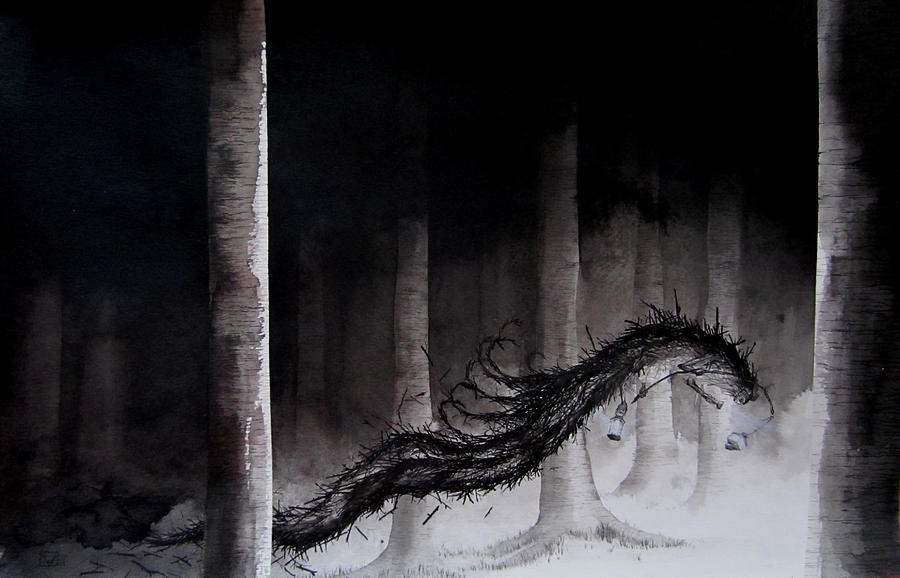
Where is `lights`? lights is located at coordinates (608, 423), (736, 443).